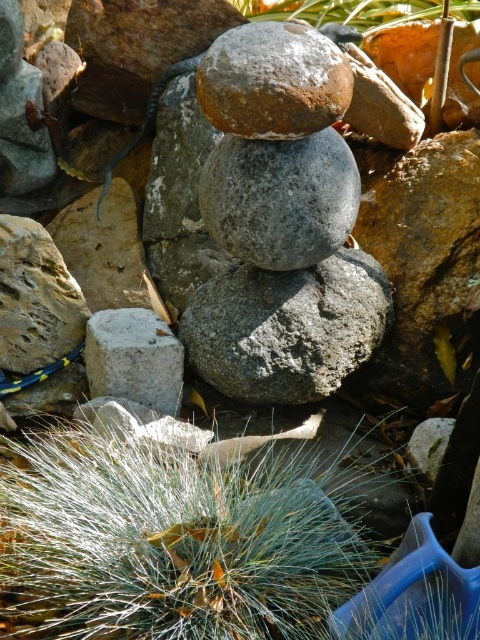
Based on the photo, does gray rough rock at center appear over gray rough concrete block at lower left?

Yes, gray rough rock at center is above gray rough concrete block at lower left.

Does gray rough rock at center lie in front of gray rough concrete block at lower left?

Yes.

Between point (350, 348) and point (88, 333), which one is positioned behind?

The point (88, 333) is behind.

At what (x,y) coordinates should I click in order to perform the action: click on gray rough rock at center. Please return your answer as a coordinate pair (x, y). The height and width of the screenshot is (640, 480). Looking at the image, I should click on (287, 326).

Can you confirm if gray rough rock at center is taller than sandy brown rock at center?

Correct, gray rough rock at center is much taller as sandy brown rock at center.

Does gray rough rock at center have a greater width compared to sandy brown rock at center?

Yes.

Which is in front, point (268, 282) or point (307, 45)?

Point (307, 45)

You are a GUI agent. You are given a task and a screenshot of the screen. Output one action in this format:
    pyautogui.click(x=<x>, y=<y>)
    Task: Click on the gray rough rock at center
    The height and width of the screenshot is (640, 480).
    Given the screenshot: What is the action you would take?
    pyautogui.click(x=287, y=326)

This screenshot has width=480, height=640. I want to click on gray matte rock at center, so point(280,198).

Image resolution: width=480 pixels, height=640 pixels. Describe the element at coordinates (280, 198) in the screenshot. I see `gray matte rock at center` at that location.

This screenshot has height=640, width=480. Identify the location of gray matte rock at center. (280, 198).